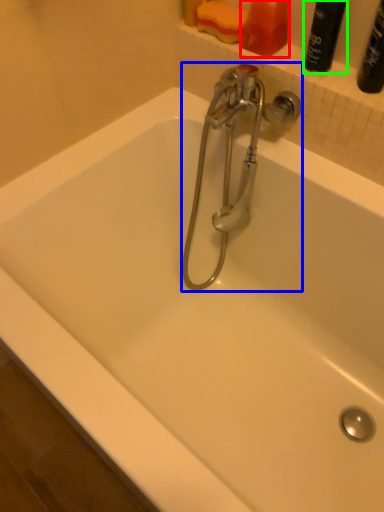
Question: Which object is the farthest from toiletry (highlighted by a red box)? Choose among these: tap (highlighted by a blue box) or cleaning product (highlighted by a green box).

Choices:
 (A) tap
 (B) cleaning product

Answer: (A)